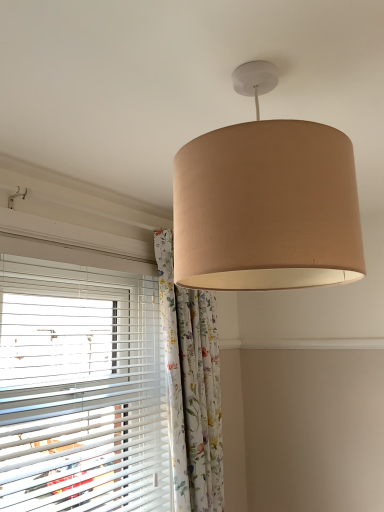
Question: Does point (200, 463) appear closer or farther from the camera than point (94, 472)?

Choices:
 (A) closer
 (B) farther

Answer: (B)

Question: From a real-world perspective, is floral fabric curtain at center above or below white plastic blinds at left?

Choices:
 (A) above
 (B) below

Answer: (B)

Question: Based on their relative distances, which object is farther from the beige fabric lampshade at upper center?

Choices:
 (A) floral fabric curtain at center
 (B) white plastic blinds at left

Answer: (A)

Question: Considering the real-world distances, which object is farthest from the floral fabric curtain at center?

Choices:
 (A) beige fabric lampshade at upper center
 (B) white plastic blinds at left

Answer: (A)